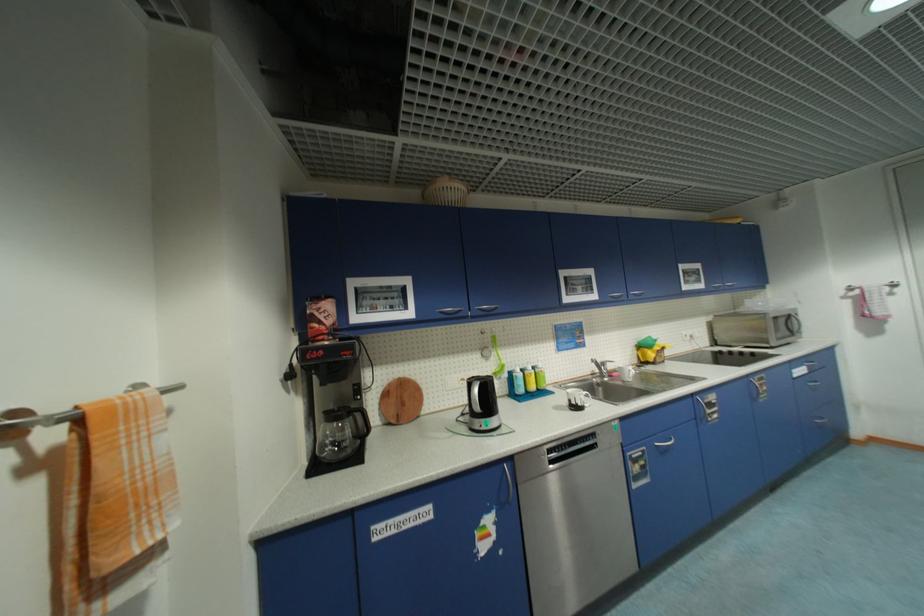
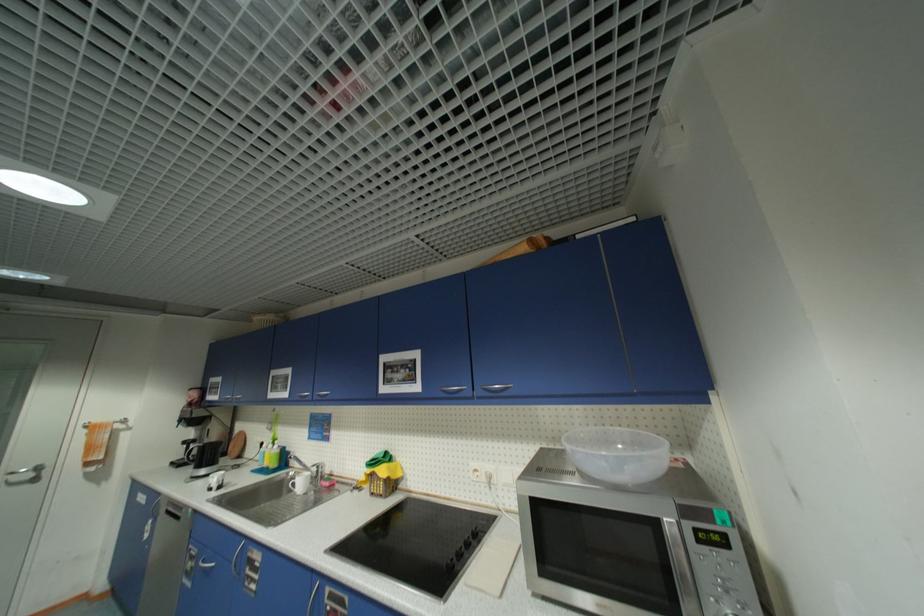
Where in the second image is the point corresponding to (643,468) from the first image?

(196, 565)